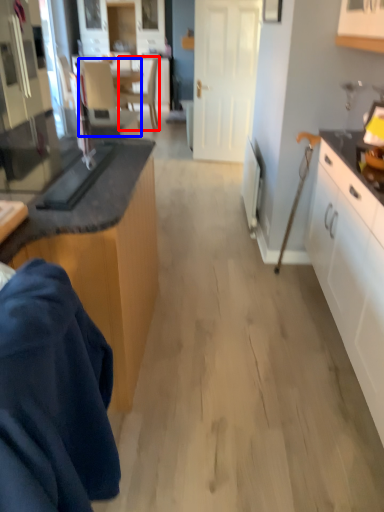
Question: Among these objects, which one is nearest to the camera, chair (highlighted by a red box) or armchair (highlighted by a blue box)?

Choices:
 (A) chair
 (B) armchair

Answer: (B)